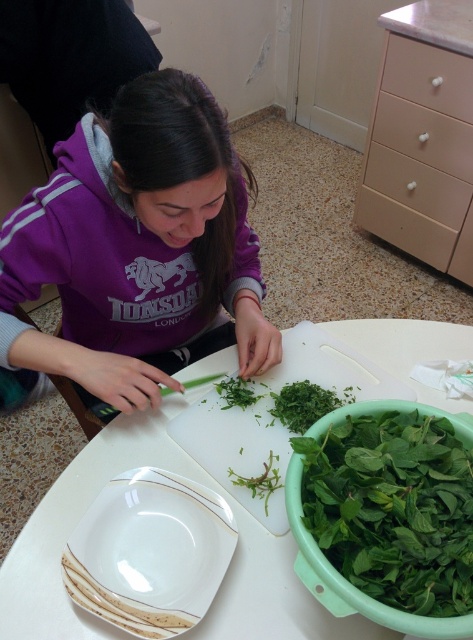
You are a food delivery robot positioned at the entrance of the kitchen. You need to deliver a dish to the counter where the person is working. The counter has two points marked as point1 and point2. Point1 is at coordinate (20, 364) and point2 is at coordinate (23, 531). The delivery must be placed at the point closest to the person. Which point should you choose?

Point1 is behind point2, so the closest point to the person is point2 at coordinate (23, 531). You should choose point2 to place the delivery.

You are setting up a table for a picnic and have a green leafy vegetable at lower right and a white plastic table at center. Which item is wider?

The white plastic table at center is wider than the green leafy vegetable at lower right.